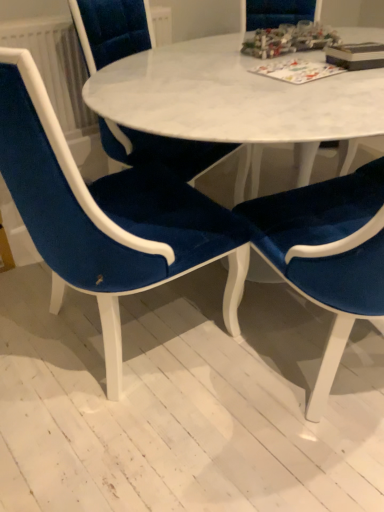
The width and height of the screenshot is (384, 512). What are the coordinates of `vacant region in front of hardcover book at upper right, the 2th book in the left-to-right sequence` in the screenshot? It's located at (348, 73).